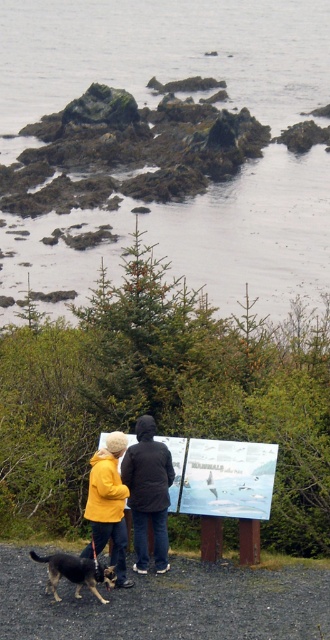
You are standing at the point marked as point (164, 51) in the coastal scene. What is located exactly at that point?

The grayish water at center is located exactly at point (164, 51).

You are standing at the edge of the shoreline and want to place a small buoy between the grayish water at center and the gravelly dirt ground at lower center. Which object should the buoy be placed closer to if you want it to be nearer to the viewer?

The buoy should be placed closer to the grayish water at center because it is further to the viewer than the gravelly dirt ground at lower center, so positioning it near the water would make it closer to the viewer.